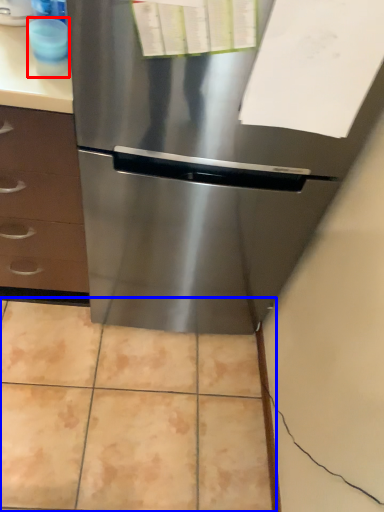
Question: Which of the following is the closest to the observer, appliance (highlighted by a red box) or ceramic tile (highlighted by a blue box)?

Choices:
 (A) appliance
 (B) ceramic tile

Answer: (A)